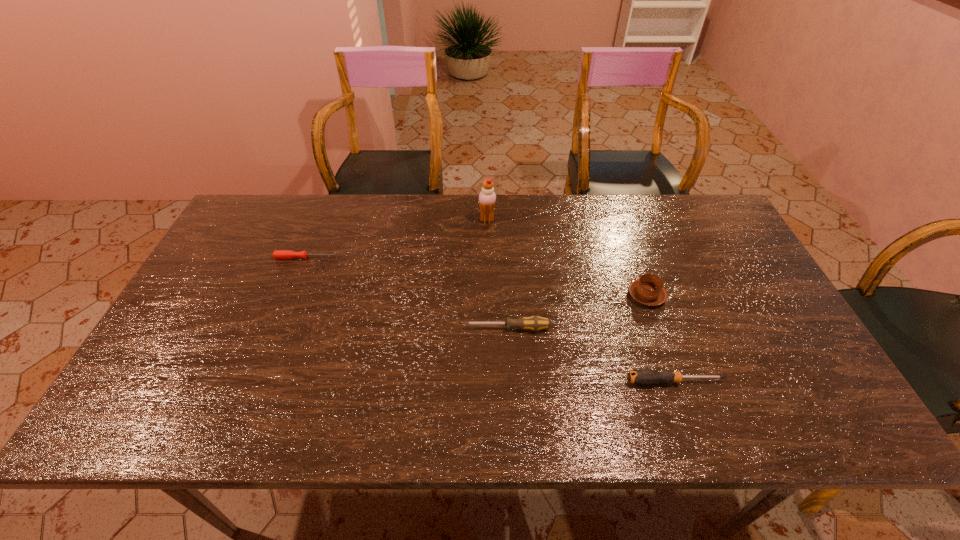
Locate an element on the screen. Image resolution: width=960 pixels, height=540 pixels. screwdriver that stands as the closest to the tallest object is located at coordinates (535, 323).

I want to click on vacant point that satisfies the following two spatial constraints: 1. at the tip of the second screwdriver from right to left; 2. on the back side of the nearest object, so click(x=511, y=381).

This screenshot has width=960, height=540. I want to click on vacant space that satisfies the following two spatial constraints: 1. at the front with a straw on the icecream; 2. on the left side of the rightmost screwdriver, so click(490, 381).

Locate an element on the screen. This screenshot has height=540, width=960. vacant space that satisfies the following two spatial constraints: 1. at the tip of the second farthest object; 2. on the back side of the nearest screwdriver is located at coordinates (257, 381).

I want to click on free space in the image that satisfies the following two spatial constraints: 1. at the tip of the leftmost screwdriver; 2. on the back side of the rightmost screwdriver, so click(x=257, y=381).

You are a GUI agent. You are given a task and a screenshot of the screen. Output one action in this format:
    pyautogui.click(x=<x>, y=<y>)
    Task: Click on the vacant space that satisfies the following two spatial constraints: 1. at the tip of the nearest screwdriver; 2. on the left side of the second nearest object
    The image size is (960, 540).
    Given the screenshot: What is the action you would take?
    pyautogui.click(x=511, y=381)

In order to click on vacant area that satisfies the following two spatial constraints: 1. at the tip of the shortest object; 2. on the left side of the nearest screwdriver in this screenshot , I will do `click(257, 381)`.